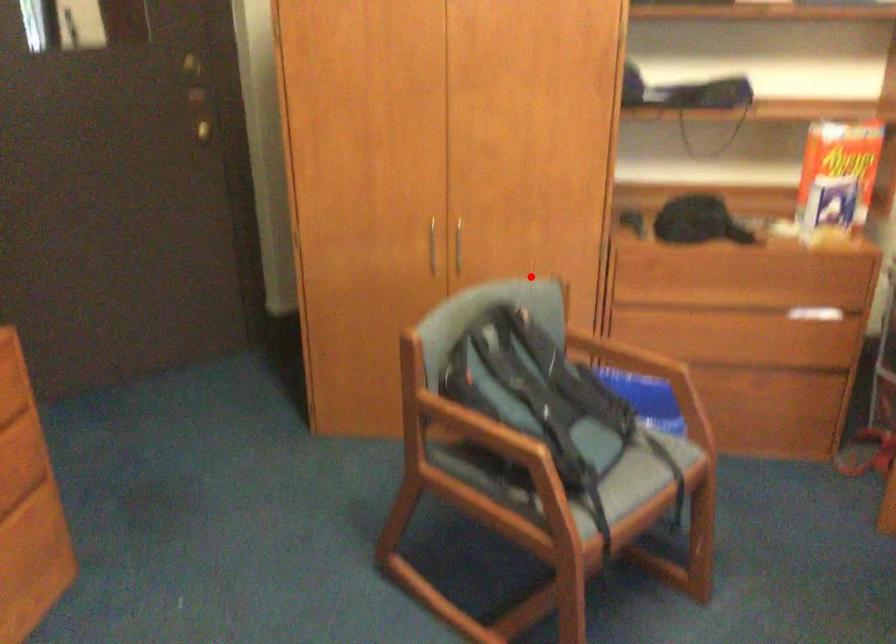
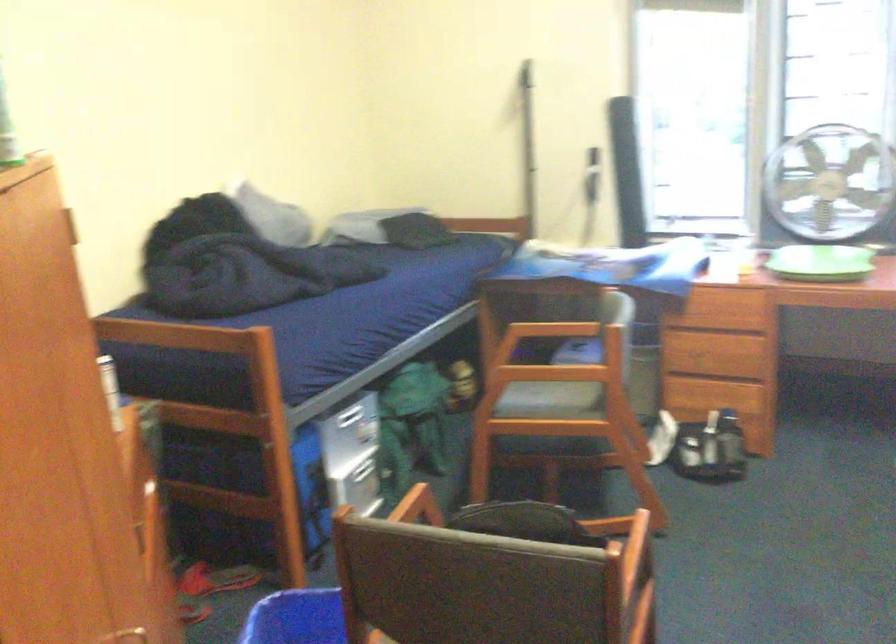
Question: I am providing you with two images of the same scene from different viewpoints. Image1 has a red point marked. In image2, the corresponding 3D location appears at what relative position? Reply with the corresponding letter.

Choices:
 (A) Closer
 (B) Farther

Answer: (A)